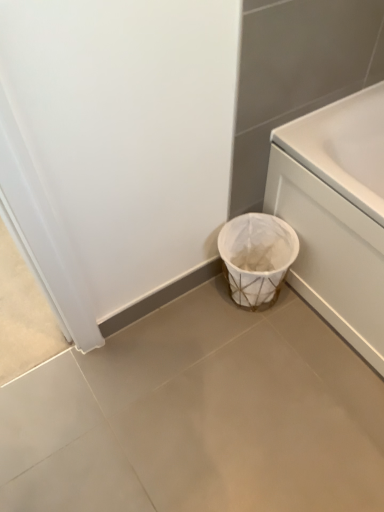
Locate an element on the screen. free space on the front side of white woven basket at lower center is located at coordinates (259, 350).